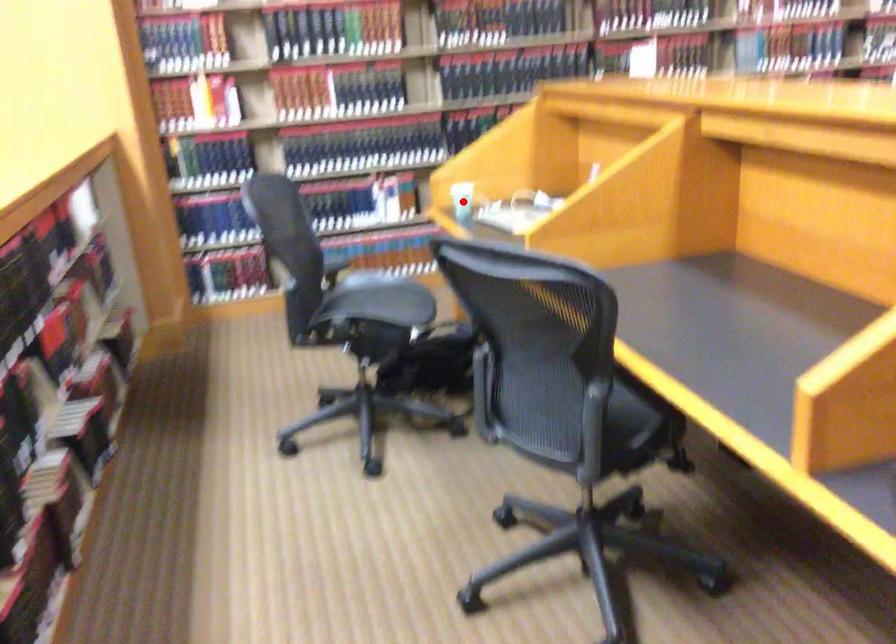
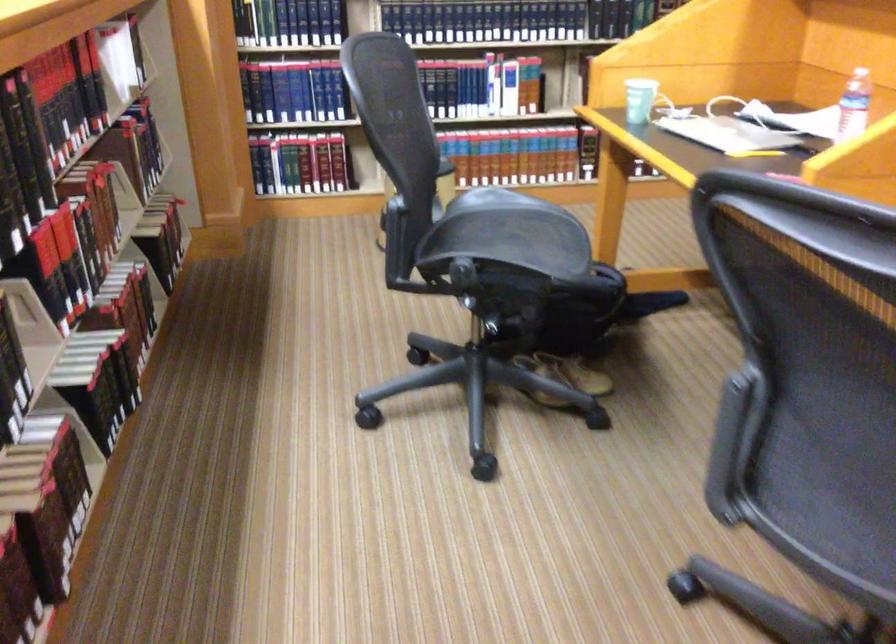
Where in the second image is the point corresponding to the highlighted location from the first image?

(640, 100)